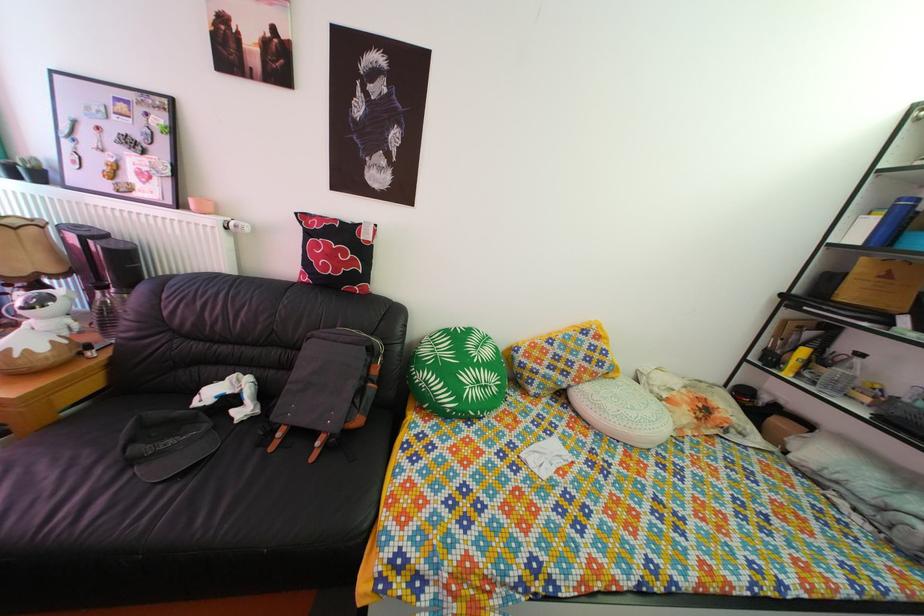
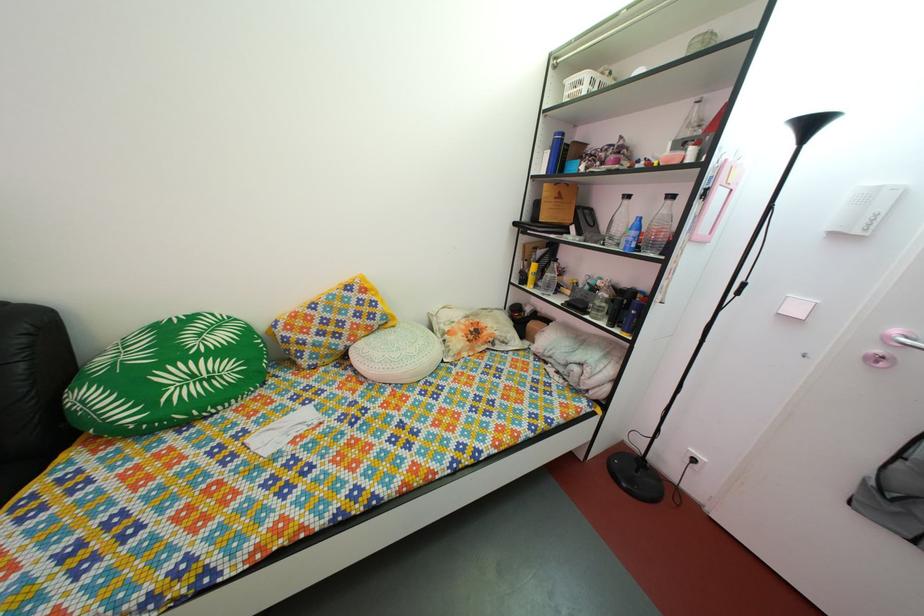
Find the pixel in the second image that matches (494,395) in the first image.

(220, 387)